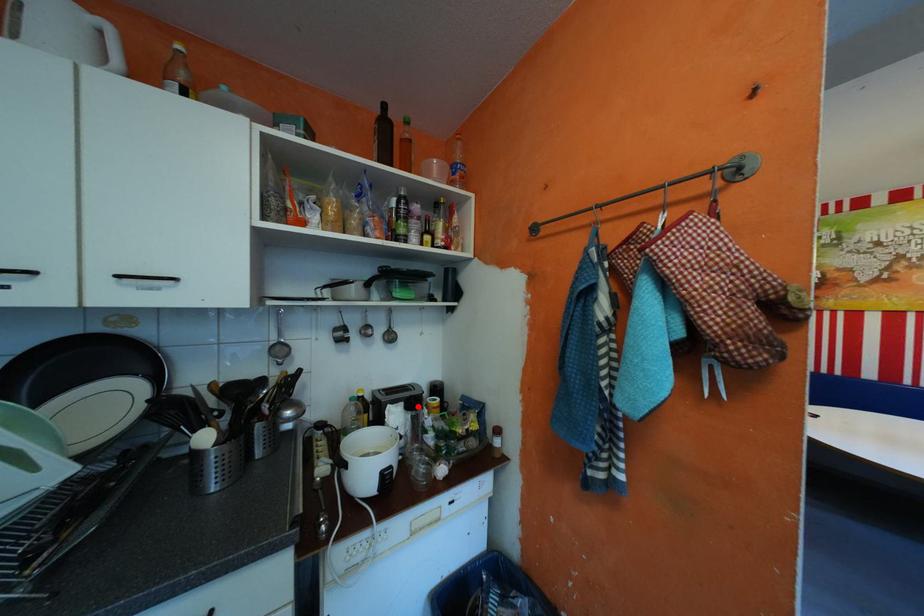
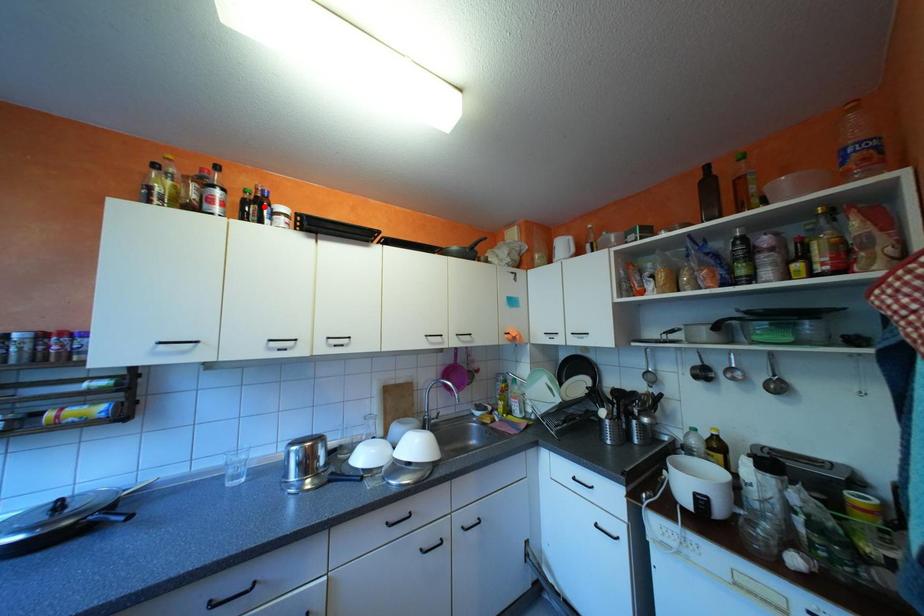
I am providing you with two images of the same scene from different viewpoints. A red point is marked on the first image and another point is marked on the second image. Does the point marked in image1 correspond to the same location as the one in image2?

No